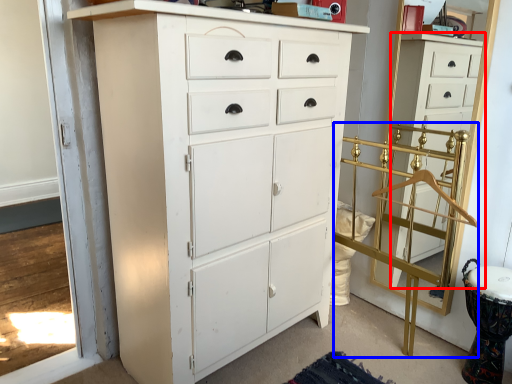
Question: Among these objects, which one is nearest to the camera, chest of drawers (highlighted by a red box) or bunk bed (highlighted by a blue box)?

Choices:
 (A) chest of drawers
 (B) bunk bed

Answer: (B)